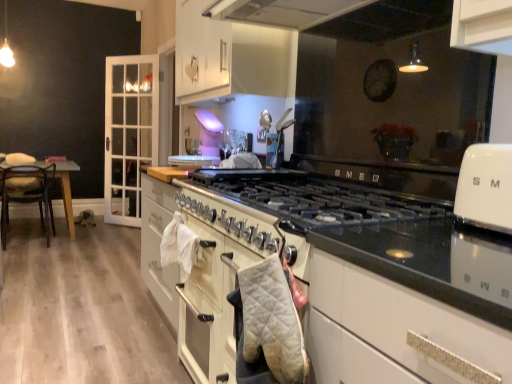
Question: From a real-world perspective, does white quilted oven mitt at center sit lower than white glossy oven at upper right?

Choices:
 (A) no
 (B) yes

Answer: (B)

Question: Considering the relative sizes of white quilted oven mitt at center and white glossy oven at upper right in the image provided, is white quilted oven mitt at center thinner than white glossy oven at upper right?

Choices:
 (A) no
 (B) yes

Answer: (B)

Question: Is white quilted oven mitt at center in contact with white glossy oven at upper right?

Choices:
 (A) no
 (B) yes

Answer: (A)

Question: Does white quilted oven mitt at center appear on the right side of white glossy oven at upper right?

Choices:
 (A) yes
 (B) no

Answer: (B)

Question: Is there a large distance between white quilted oven mitt at center and white glossy oven at upper right?

Choices:
 (A) yes
 (B) no

Answer: (B)

Question: Considering the positions of white glossy cabinet at left, the 2th cabinetry from the right, and wooden chair at left in the image, is white glossy cabinet at left, the 2th cabinetry from the right, wider or thinner than wooden chair at left?

Choices:
 (A) thin
 (B) wide

Answer: (A)

Question: Considering the positions of point pyautogui.click(x=120, y=148) and point pyautogui.click(x=0, y=215), is point pyautogui.click(x=120, y=148) closer or farther from the camera than point pyautogui.click(x=0, y=215)?

Choices:
 (A) closer
 (B) farther

Answer: (B)

Question: From a real-world perspective, is white glossy cabinet at left, which is counted as the 2th cabinetry, starting from the front, positioned above or below wooden chair at left?

Choices:
 (A) above
 (B) below

Answer: (A)

Question: Would you say white glossy cabinet at left, which is counted as the 2th cabinetry, starting from the front, is inside or outside wooden chair at left?

Choices:
 (A) outside
 (B) inside

Answer: (A)

Question: Is white quilted oven mitt at center taller or shorter than wooden chair at left?

Choices:
 (A) short
 (B) tall

Answer: (A)

Question: Considering their positions, is white quilted oven mitt at center located in front of or behind wooden chair at left?

Choices:
 (A) front
 (B) behind

Answer: (A)

Question: From the image's perspective, is white quilted oven mitt at center positioned above or below wooden chair at left?

Choices:
 (A) above
 (B) below

Answer: (B)

Question: From a real-world perspective, is white quilted oven mitt at center positioned above or below wooden chair at left?

Choices:
 (A) below
 (B) above

Answer: (B)

Question: Is white quilted oven mitt at center situated inside white glossy oven at upper right or outside?

Choices:
 (A) outside
 (B) inside

Answer: (A)

Question: Is white quilted oven mitt at center to the left or to the right of white glossy oven at upper right in the image?

Choices:
 (A) left
 (B) right

Answer: (A)